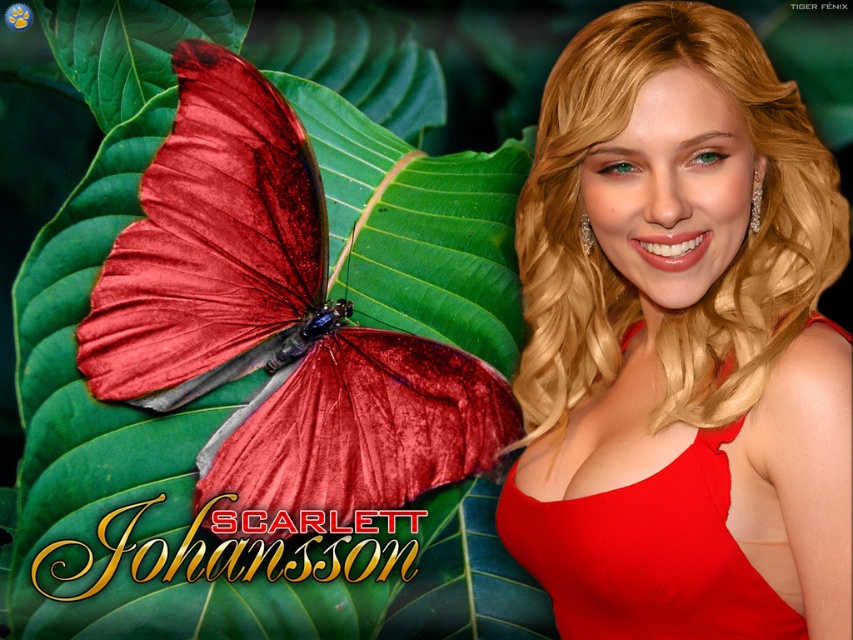
Question: Which of the following is the farthest from the observer?

Choices:
 (A) (289, 195)
 (B) (590, 637)

Answer: (A)

Question: Which of the following is the farthest from the observer?

Choices:
 (A) 693,541
 (B) 369,499

Answer: (B)

Question: Can you confirm if velvet-like red butterfly at left is smaller than matte red dress at right?

Choices:
 (A) yes
 (B) no

Answer: (B)

Question: Observing the image, what is the correct spatial positioning of velvet-like red butterfly at left in reference to matte red dress at right?

Choices:
 (A) below
 (B) above

Answer: (B)

Question: Is velvet-like red butterfly at left positioned before matte red dress at right?

Choices:
 (A) no
 (B) yes

Answer: (A)

Question: Among these points, which one is farthest from the camera?

Choices:
 (A) (212, 502)
 (B) (602, 632)

Answer: (A)